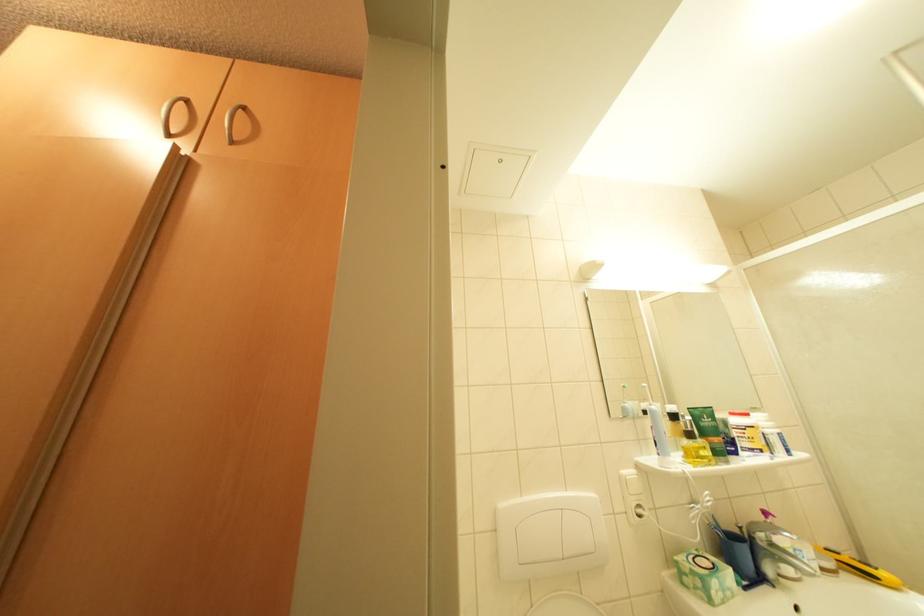
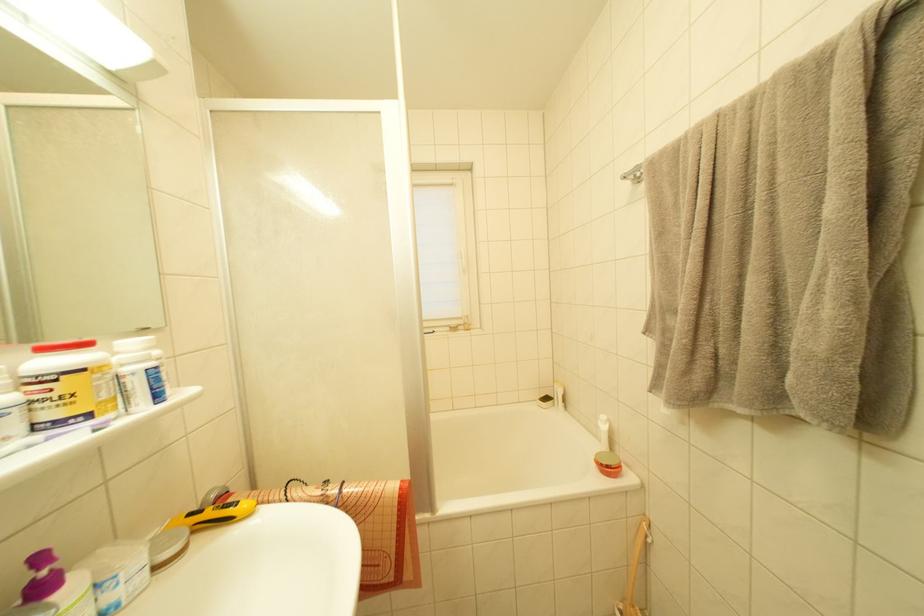
Find the pixel in the second image that matches (716,288) in the first image.

(127, 84)